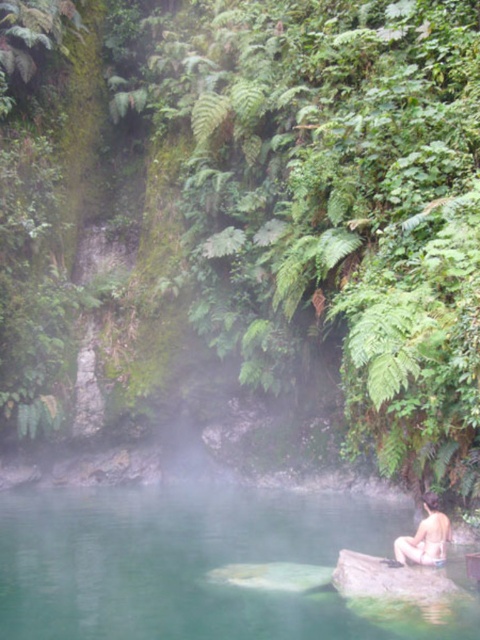
Is green smooth water at lower center to the left of nude human at lower right from the viewer's perspective?

Indeed, green smooth water at lower center is positioned on the left side of nude human at lower right.

Between green smooth water at lower center and nude human at lower right, which one has less height?

nude human at lower right is shorter.

At what (x,y) coordinates should I click in order to perform the action: click on green smooth water at lower center. Please return your answer as a coordinate pair (x, y). The width and height of the screenshot is (480, 640). Looking at the image, I should click on (184, 563).